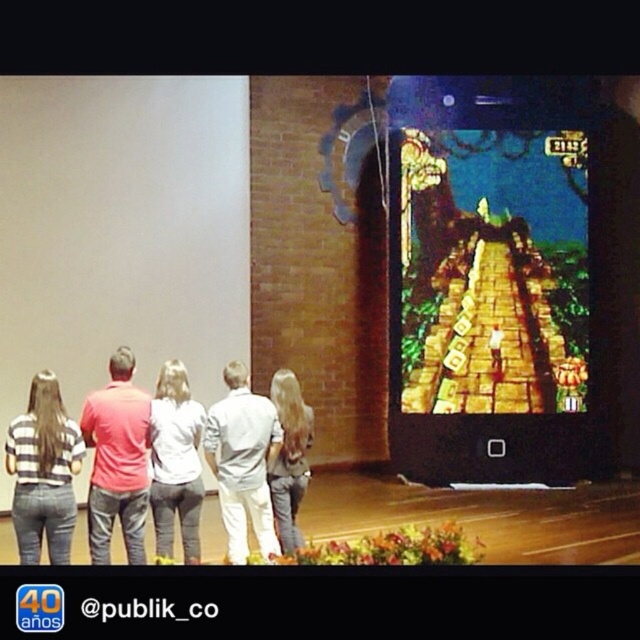
You are a game developer analyzing the positioning of two points on the screen for a new feature. The points are labeled as point (138, 554) and point (276, 401). Based on their positions, which point is closer to the screen where the game character is moving?

Point (138, 554) is in front of point (276, 401), so it is closer to the screen where the game character is moving.

You are part of the group watching the video game. You want to tap the person wearing the red shirt at left on the shoulder to get their attention. Can you do this without moving past the denim jeans at center?

The red shirt at left is in front of denim jeans at center, so you can tap the red shirt at left on the shoulder without needing to move past the denim jeans at center.